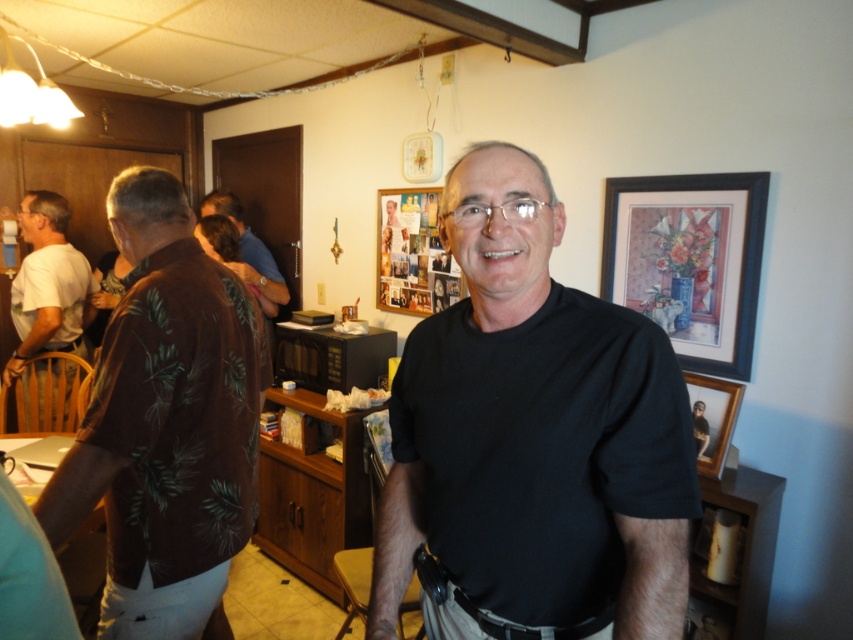
Question: Which point is farther from the camera taking this photo?

Choices:
 (A) (265, 314)
 (B) (683, 380)
 (C) (67, 212)

Answer: (A)

Question: Where is brown floral shirt at center located in relation to wooden picture frame at center in the image?

Choices:
 (A) below
 (B) above

Answer: (B)

Question: Among these objects, which one is farthest from the camera?

Choices:
 (A) wooden picture frame at upper center
 (B) wooden picture frame at center
 (C) brown floral shirt at left
 (D) black framed picture at upper right

Answer: (A)

Question: Can you confirm if black framed picture at upper right is positioned below white cotton shirt at left?

Choices:
 (A) yes
 (B) no

Answer: (B)

Question: Observing the image, what is the correct spatial positioning of black matte shirt at center in reference to brown floral shirt at center?

Choices:
 (A) below
 (B) above

Answer: (A)

Question: Which point is closer to the camera?

Choices:
 (A) (714, 369)
 (B) (714, 381)
 (C) (189, 561)

Answer: (C)